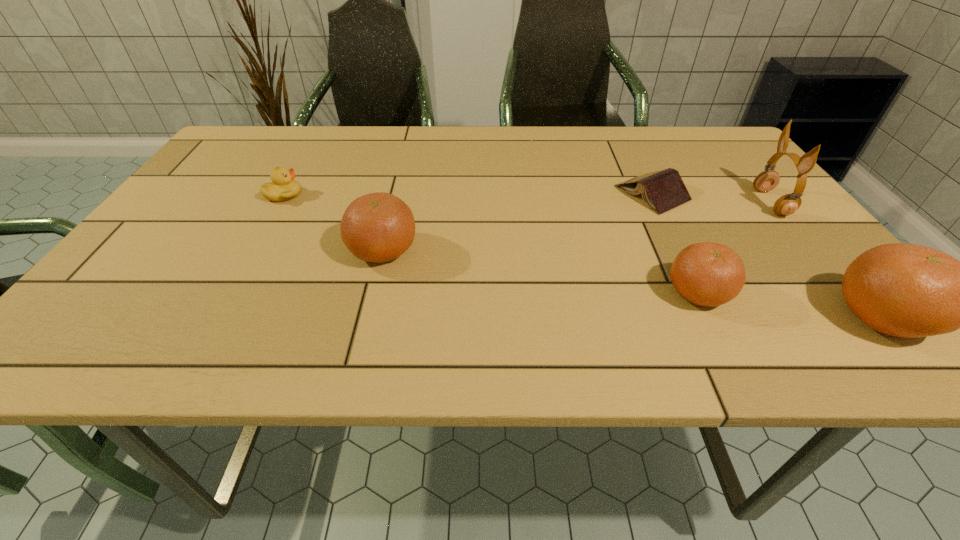
Identify the location of vacant region located 0.390m on the left of the shortest object. (460, 193).

Locate an element on the screen. vacant area situated 0.360m on the front-facing side of the earphone is located at coordinates (610, 203).

At what (x,y) coordinates should I click in order to perform the action: click on vacant space situated on the front-facing side of the earphone. Please return your answer as a coordinate pair (x, y). This screenshot has height=540, width=960. Looking at the image, I should click on [x=663, y=203].

Locate an element on the screen. The height and width of the screenshot is (540, 960). vacant space located on the front-facing side of the earphone is located at coordinates (605, 203).

What are the coordinates of `vacant space located 0.120m on the beak of the duckling` in the screenshot? It's located at click(349, 194).

Identify the location of object present at the near edge. (709, 274).

Where is `object that is at the right edge`? object that is at the right edge is located at coordinates (767, 180).

The width and height of the screenshot is (960, 540). In the image, there is a desktop. Identify the location of vacant space at the far edge. (441, 149).

The height and width of the screenshot is (540, 960). In the image, there is a desktop. Identify the location of free space at the near edge. (605, 287).

I want to click on vacant space at the right edge of the desktop, so click(x=783, y=275).